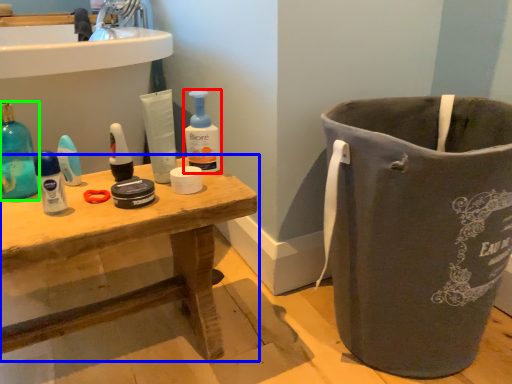
Question: Which object is positioned closest to cleaning product (highlighted by a red box)? Select from table (highlighted by a blue box) and cleaning product (highlighted by a green box).

Choices:
 (A) table
 (B) cleaning product

Answer: (A)